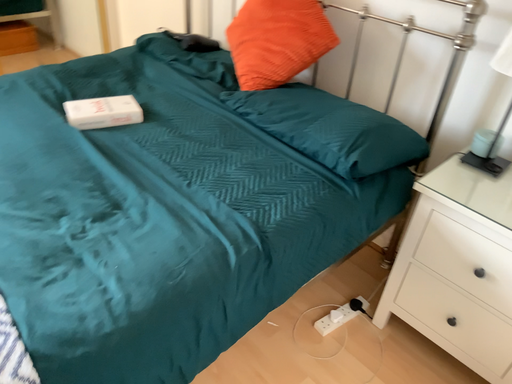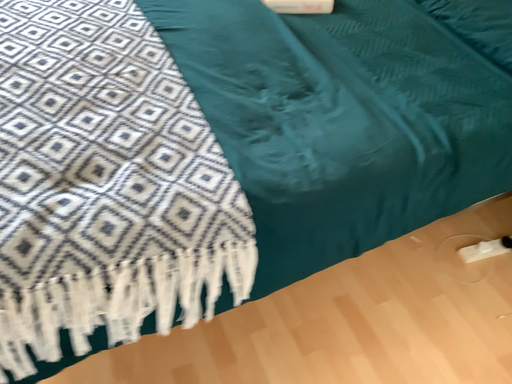
Question: Which way did the camera rotate in the video?

Choices:
 (A) rotated upward
 (B) rotated downward

Answer: (B)